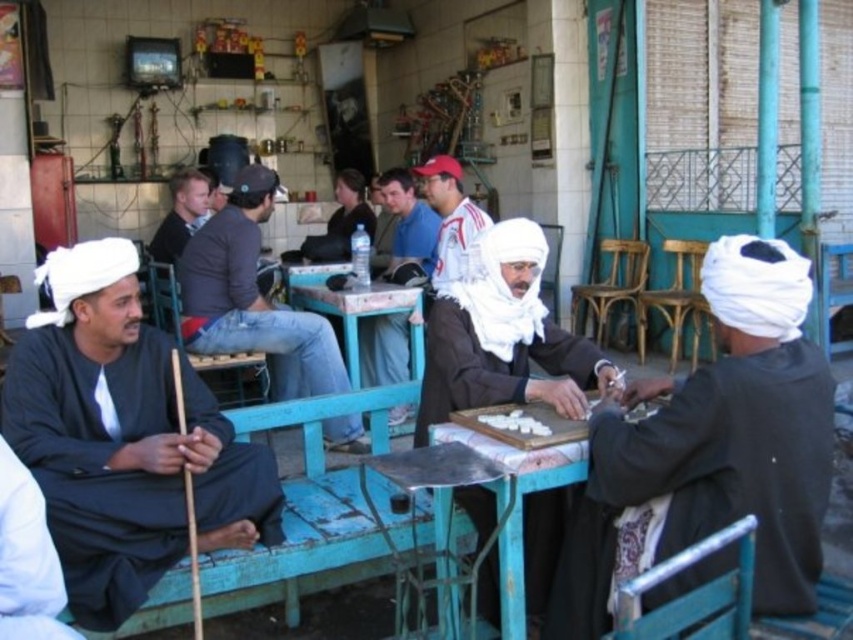
Can you confirm if dark gray sweater at center is positioned below wooden at center?

Actually, dark gray sweater at center is above wooden at center.

Is point (294, 397) positioned in front of point (648, 388)?

No, (294, 397) is further to viewer.

This screenshot has height=640, width=853. What do you see at coordinates (252, 298) in the screenshot?
I see `dark gray sweater at center` at bounding box center [252, 298].

The height and width of the screenshot is (640, 853). What are the coordinates of `dark gray sweater at center` in the screenshot? It's located at (252, 298).

Does dark gray sweater at center have a smaller size compared to blue denim jeans at center?

Actually, dark gray sweater at center might be larger than blue denim jeans at center.

Between dark gray sweater at center and blue denim jeans at center, which one is positioned lower?

dark gray sweater at center is below.

Who is more forward, (x=329, y=324) or (x=367, y=339)?

Point (x=329, y=324) is in front.

Identify the location of dark gray sweater at center. The width and height of the screenshot is (853, 640). (252, 298).

Who is shorter, dark gray sweater at center or white cotton turban at center?

With less height is white cotton turban at center.

Does point (320, 349) come in front of point (434, 177)?

Yes, it is.

Who is more distant from viewer, (250, 212) or (445, 280)?

The point (445, 280) is more distant.

You are a GUI agent. You are given a task and a screenshot of the screen. Output one action in this format:
    pyautogui.click(x=<x>, y=<y>)
    Task: Click on the dark gray sweater at center
    The height and width of the screenshot is (640, 853).
    Given the screenshot: What is the action you would take?
    pyautogui.click(x=252, y=298)